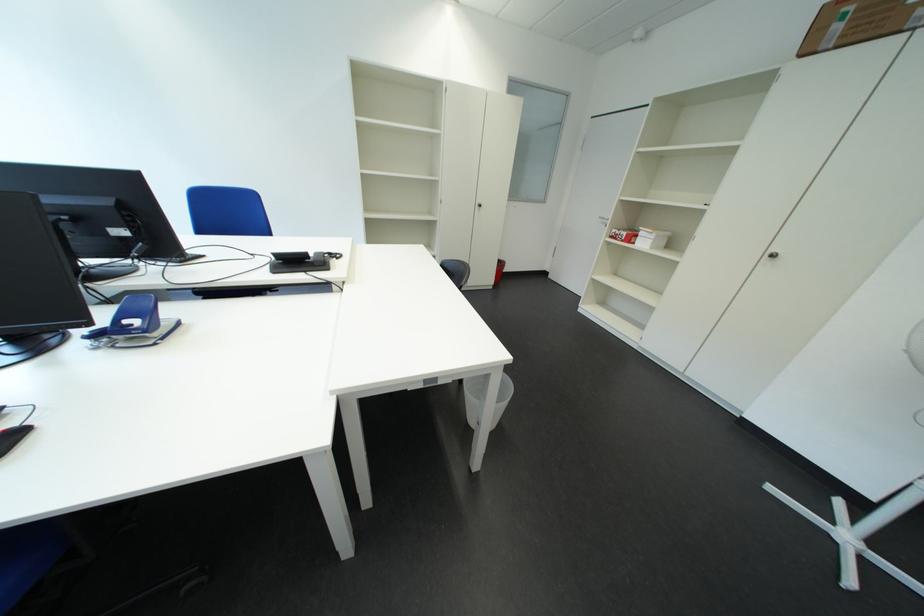
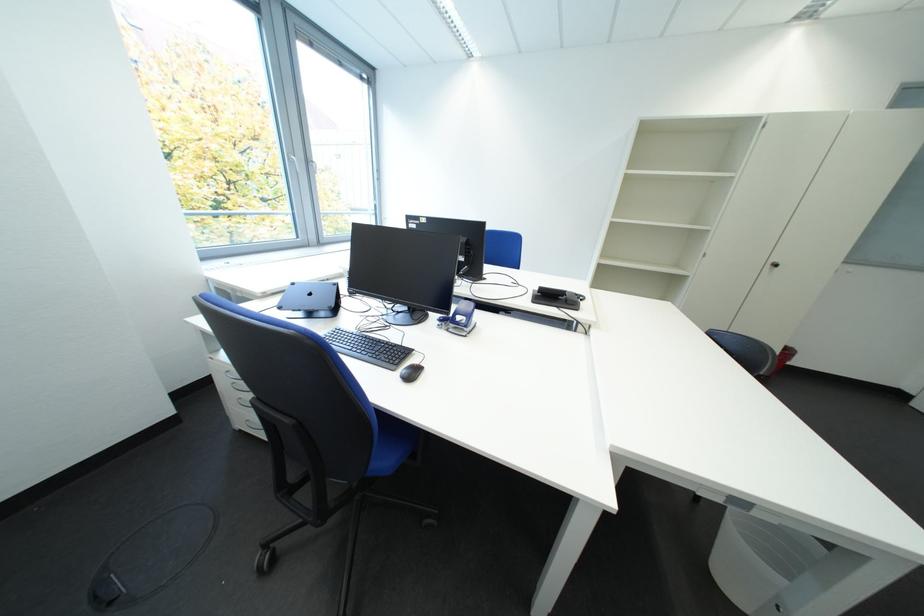
Locate, in the second image, the point that corresponds to (x=342, y=256) in the first image.

(586, 297)